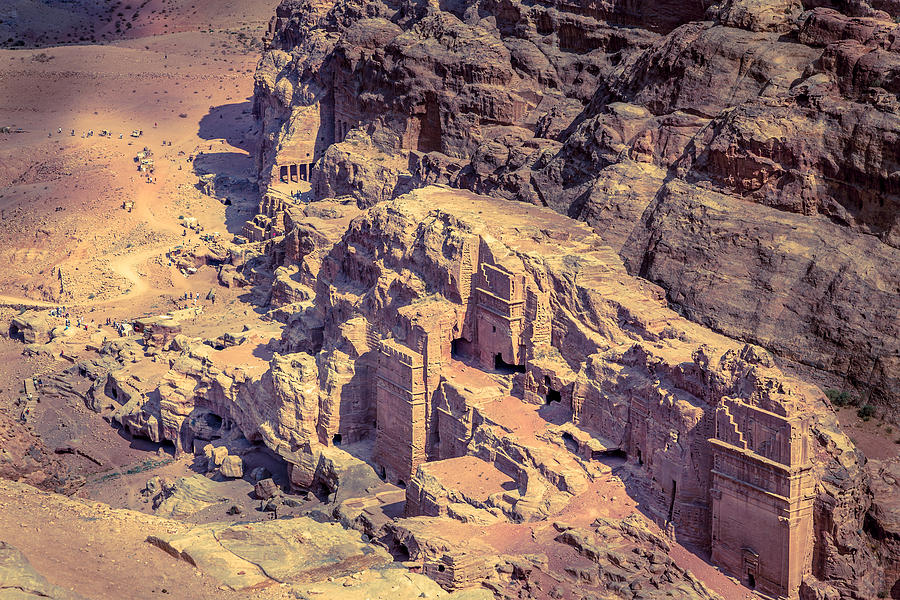
At what (x,y) coordinates should I click in order to perform the action: click on columns. Please return your answer as a coordinate pair (x, y). This screenshot has width=900, height=600. Looking at the image, I should click on (286, 176), (297, 173), (307, 173).